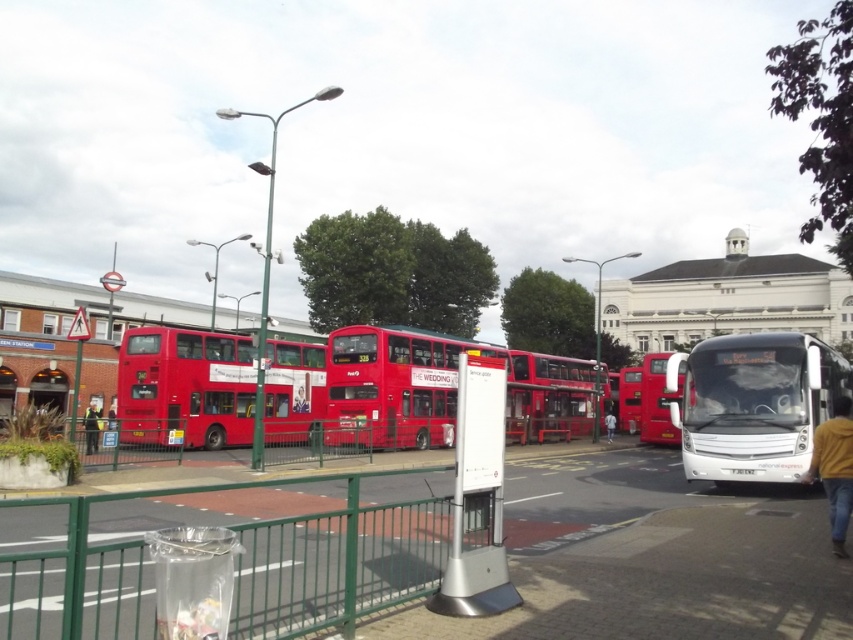
You are a delivery person who needs to place a package on the green metal fence at lower left. The matte red bus at center is blocking your path. Can you walk around it to reach the fence?

The green metal fence at lower left and matte red bus at center are 11.96 meters apart, so yes, you can walk around the matte red bus at center to reach the green metal fence at lower left since there is enough space between them.

You are a delivery person trying to see the white signpost behind the green metal fence at lower left and the matte red bus at center. Which object is blocking your view more?

The matte red bus at center is taller than the green metal fence at lower left, so it blocks your view more.